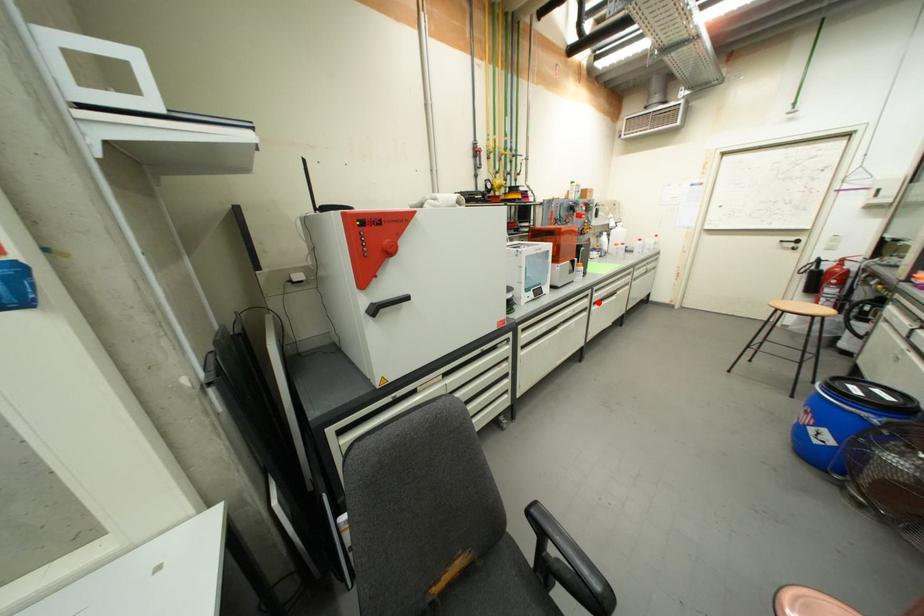
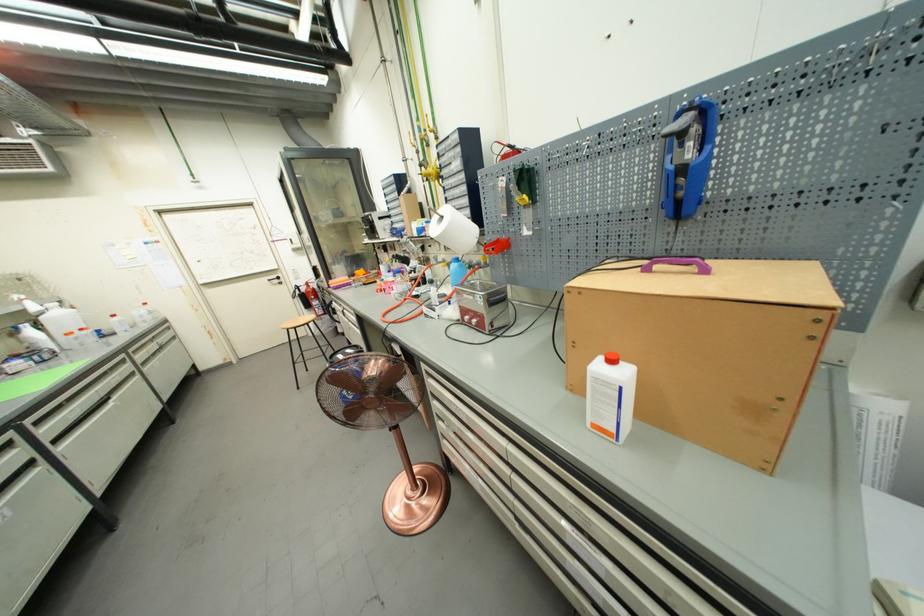
Find the pixel in the second image that matches the highlighted location in the first image.

(52, 440)